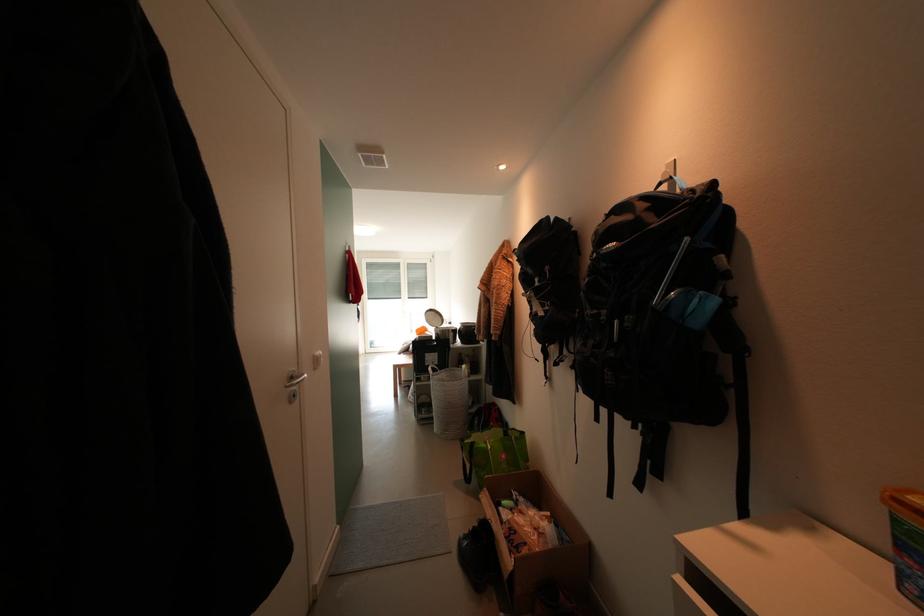
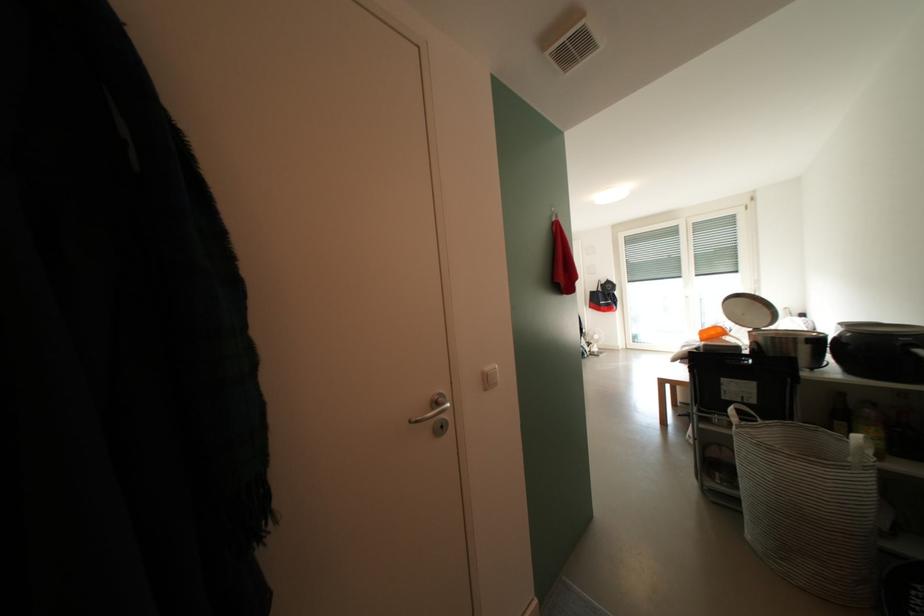
In the second image, find the point that corresponds to point 450,378 in the first image.

(779, 435)